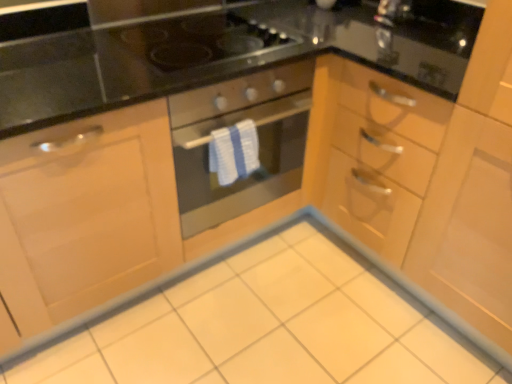
Question: Is black glass gas stove at upper center completely or partially inside white glossy ceramic tile at center?

Choices:
 (A) yes
 (B) no

Answer: (B)

Question: Is white glossy ceramic tile at center positioned behind black glass gas stove at upper center?

Choices:
 (A) yes
 (B) no

Answer: (B)

Question: From a real-world perspective, is white glossy ceramic tile at center positioned under black glass gas stove at upper center based on gravity?

Choices:
 (A) no
 (B) yes

Answer: (B)

Question: Is white glossy ceramic tile at center turned away from black glass gas stove at upper center?

Choices:
 (A) yes
 (B) no

Answer: (B)

Question: Is white glossy ceramic tile at center placed right next to black glass gas stove at upper center?

Choices:
 (A) no
 (B) yes

Answer: (A)

Question: Can you confirm if white glossy ceramic tile at center is positioned to the left of black glass gas stove at upper center?

Choices:
 (A) no
 (B) yes

Answer: (A)

Question: Can you confirm if black glass gas stove at upper center is positioned to the right of matte black oven at center?

Choices:
 (A) yes
 (B) no

Answer: (B)

Question: Is black glass gas stove at upper center surrounding matte black oven at center?

Choices:
 (A) yes
 (B) no

Answer: (B)

Question: Is black glass gas stove at upper center next to matte black oven at center and touching it?

Choices:
 (A) no
 (B) yes

Answer: (A)

Question: Considering the relative sizes of black glass gas stove at upper center and matte black oven at center in the image provided, is black glass gas stove at upper center wider than matte black oven at center?

Choices:
 (A) no
 (B) yes

Answer: (A)

Question: Considering the relative sizes of black glass gas stove at upper center and matte black oven at center in the image provided, is black glass gas stove at upper center shorter than matte black oven at center?

Choices:
 (A) no
 (B) yes

Answer: (B)

Question: From a real-world perspective, is black glass gas stove at upper center positioned over matte black oven at center based on gravity?

Choices:
 (A) yes
 (B) no

Answer: (A)

Question: Considering the relative sizes of matte black oven at center and white glossy ceramic tile at center in the image provided, is matte black oven at center thinner than white glossy ceramic tile at center?

Choices:
 (A) no
 (B) yes

Answer: (B)